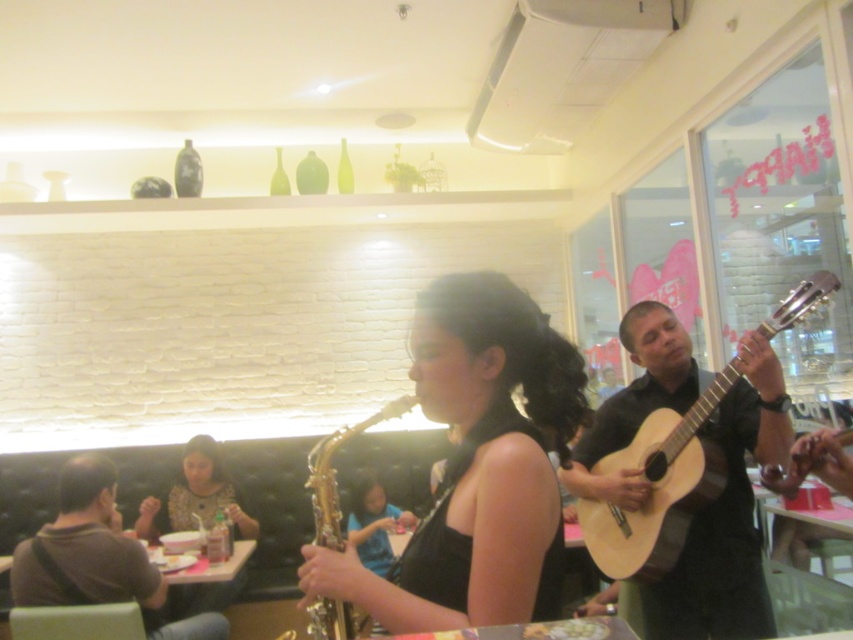
Between brown fabric shirt at lower left and matte black dress at center, which one appears on the left side from the viewer's perspective?

From the viewer's perspective, matte black dress at center appears more on the left side.

Which is more to the right, brown fabric shirt at lower left or matte black dress at center?

From the viewer's perspective, brown fabric shirt at lower left appears more on the right side.

Find the location of a particular element. Image resolution: width=853 pixels, height=640 pixels. brown fabric shirt at lower left is located at coordinates [x=97, y=557].

Describe the element at coordinates (477, 467) in the screenshot. I see `gold shiny saxophone at center` at that location.

Who is higher up, gold shiny saxophone at center or light wood acoustic guitar at right?

gold shiny saxophone at center

Find the location of a particular element. The image size is (853, 640). gold shiny saxophone at center is located at coordinates (477, 467).

Who is more forward, (112,550) or (643,532)?

Point (643,532)

Can you confirm if brown fabric shirt at lower left is smaller than light wood acoustic guitar at right?

Incorrect, brown fabric shirt at lower left is not smaller in size than light wood acoustic guitar at right.

Locate an element on the screen. This screenshot has height=640, width=853. brown fabric shirt at lower left is located at coordinates (97, 557).